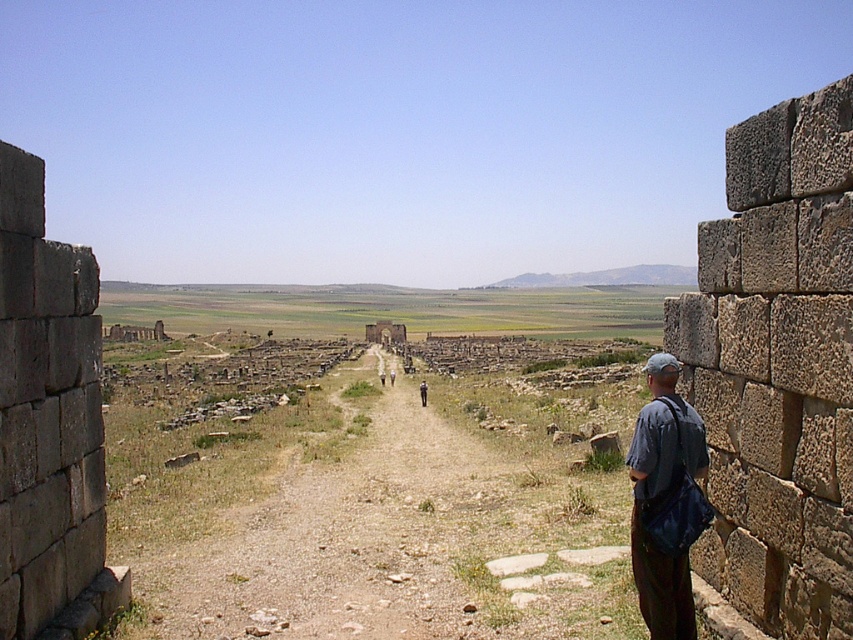
Measure the distance between dark gray fabric bag at right and dark blue jeans at center.

They are 38.67 meters apart.

Who is positioned more to the left, dark gray fabric bag at right or dark blue jeans at center?

Positioned to the left is dark blue jeans at center.

Between point (641, 554) and point (422, 390), which one is positioned in front?

Point (641, 554)

Where is `dark gray fabric bag at right`? This screenshot has height=640, width=853. dark gray fabric bag at right is located at coordinates (666, 500).

Can you confirm if stone wall at right is wider than brown stone wall at left?

Indeed, stone wall at right has a greater width compared to brown stone wall at left.

Is point (811, 467) in front of point (102, 588)?

Yes, it is.

Locate an element on the screen. stone wall at right is located at coordinates 776,368.

Does stone wall at right appear under dark blue jeans at center?

No.

Is stone wall at right positioned behind dark blue jeans at center?

That is False.

Which is behind, point (776, 420) or point (422, 401)?

The point (422, 401) is behind.

Where is `stone wall at right`? stone wall at right is located at coordinates (776, 368).